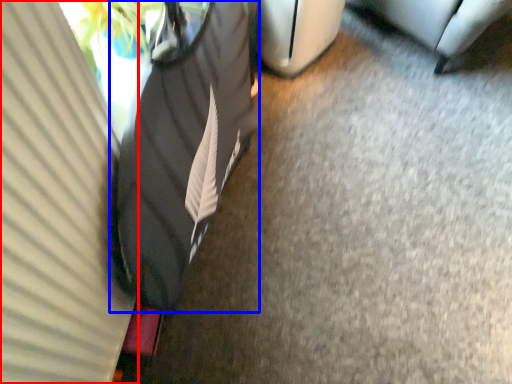
Question: Which object is further to the camera taking this photo, curtain (highlighted by a red box) or bean bag chair (highlighted by a blue box)?

Choices:
 (A) curtain
 (B) bean bag chair

Answer: (B)